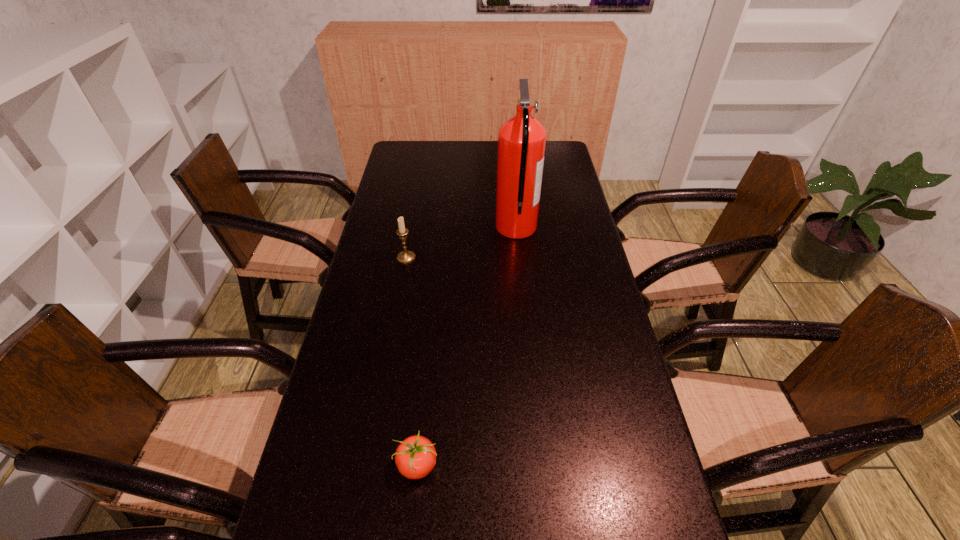
Locate an element on the screen. This screenshot has width=960, height=540. vacant area that lies between the tallest object and the leftmost object is located at coordinates (461, 242).

At what (x,y) coordinates should I click in order to perform the action: click on free space between the tomato and the fire extinguisher. Please return your answer as a coordinate pair (x, y). Looking at the image, I should click on (467, 347).

Where is `free space between the tomato and the farthest object`? free space between the tomato and the farthest object is located at coordinates (467, 347).

Find the location of a particular element. The height and width of the screenshot is (540, 960). free space that is in between the nearest object and the second nearest object is located at coordinates (412, 361).

Where is `free area in between the tomato and the rightmost object`? The image size is (960, 540). free area in between the tomato and the rightmost object is located at coordinates (467, 347).

Locate an element on the screen. empty space that is in between the farthest object and the tomato is located at coordinates (467, 347).

You are a GUI agent. You are given a task and a screenshot of the screen. Output one action in this format:
    pyautogui.click(x=<x>, y=<y>)
    Task: Click on the free space between the tallest object and the second nearest object
    The image size is (960, 540).
    Given the screenshot: What is the action you would take?
    pyautogui.click(x=461, y=242)

Image resolution: width=960 pixels, height=540 pixels. In order to click on object that is the second closest to the second object from left to right in this screenshot , I will do `click(521, 139)`.

Identify the location of the closest object to the candle holder. (521, 139).

Find the location of `vacant area that satisfies the following two spatial constraints: 1. on the front side of the shortest object; 2. on the right side of the second nearest object`. vacant area that satisfies the following two spatial constraints: 1. on the front side of the shortest object; 2. on the right side of the second nearest object is located at coordinates (369, 465).